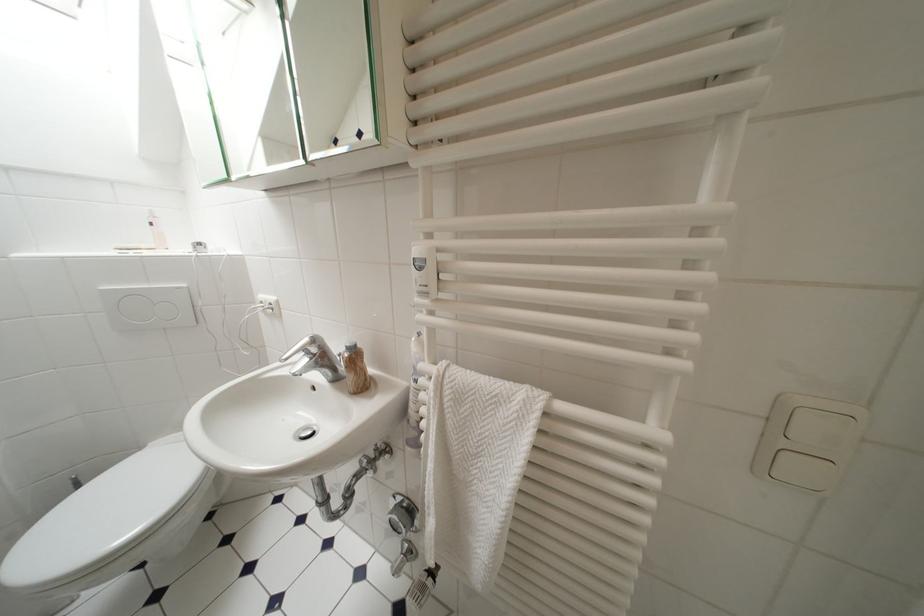
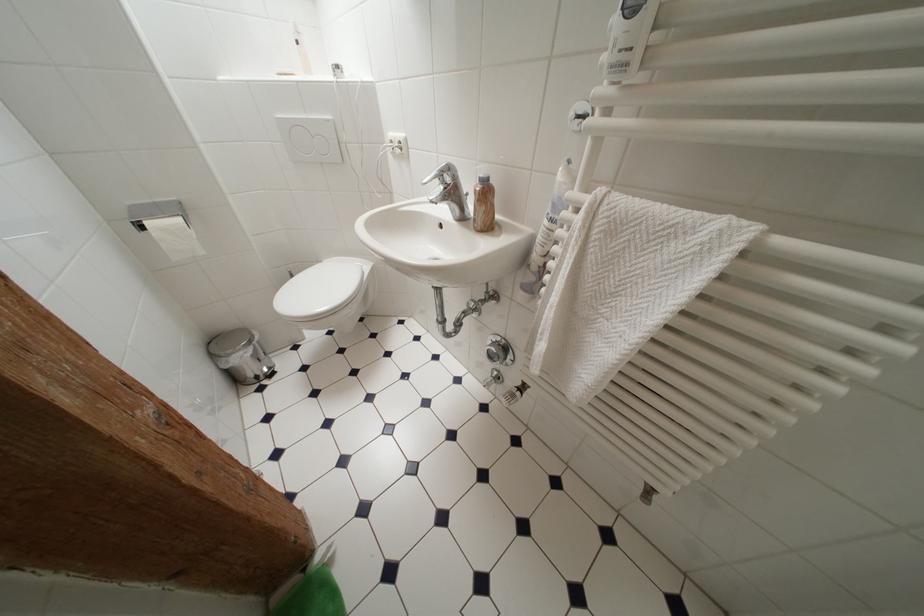
In the second image, find the point that corresponds to point (430, 440) in the first image.

(553, 280)